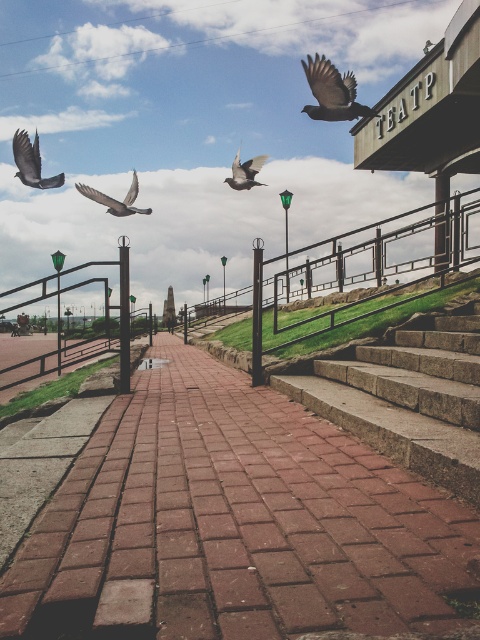
Question: Which object appears closest to the camera in this image?

Choices:
 (A) matte black bird at upper right
 (B) matte gray bird at center
 (C) gray matte pigeon at upper left

Answer: (A)

Question: Which object is closer to the camera taking this photo?

Choices:
 (A) brick pavement at center
 (B) gray matte pigeon at upper left
 (C) matte gray bird at center
 (D) matte black bird at upper right

Answer: (A)

Question: Does gray matte pigeon at upper left have a lesser width compared to matte gray bird at center?

Choices:
 (A) no
 (B) yes

Answer: (B)

Question: Which of these objects is positioned farthest from the gray matte pigeon at center?

Choices:
 (A) matte gray bird at center
 (B) brick pavement at center

Answer: (B)

Question: Observing the image, what is the correct spatial positioning of stone steps at center in reference to matte gray bird at center?

Choices:
 (A) above
 (B) below

Answer: (B)

Question: Is stone steps at center thinner than gray matte pigeon at upper left?

Choices:
 (A) yes
 (B) no

Answer: (A)